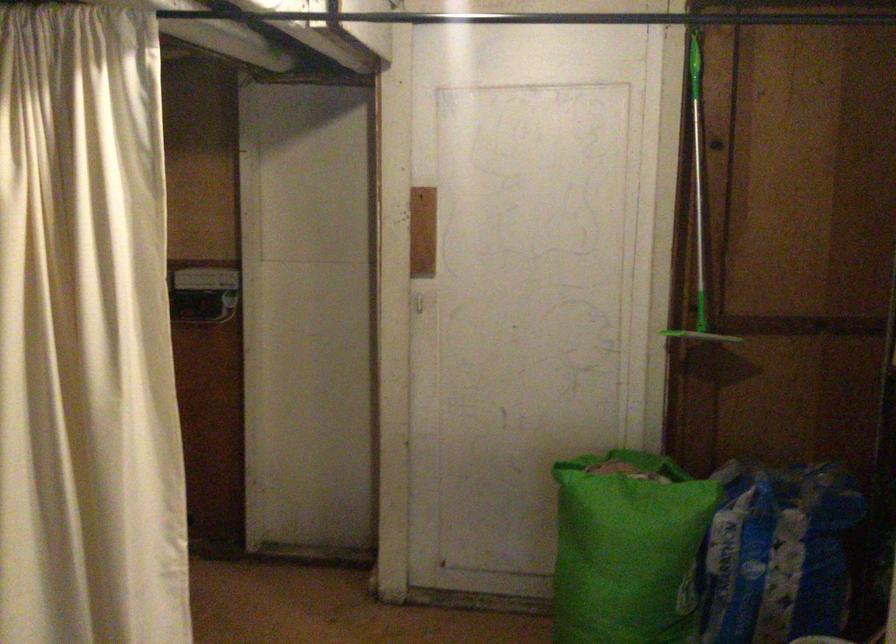
Where would you lift the green tote bag? Please return your answer as a coordinate pair (x, y).

(625, 547)